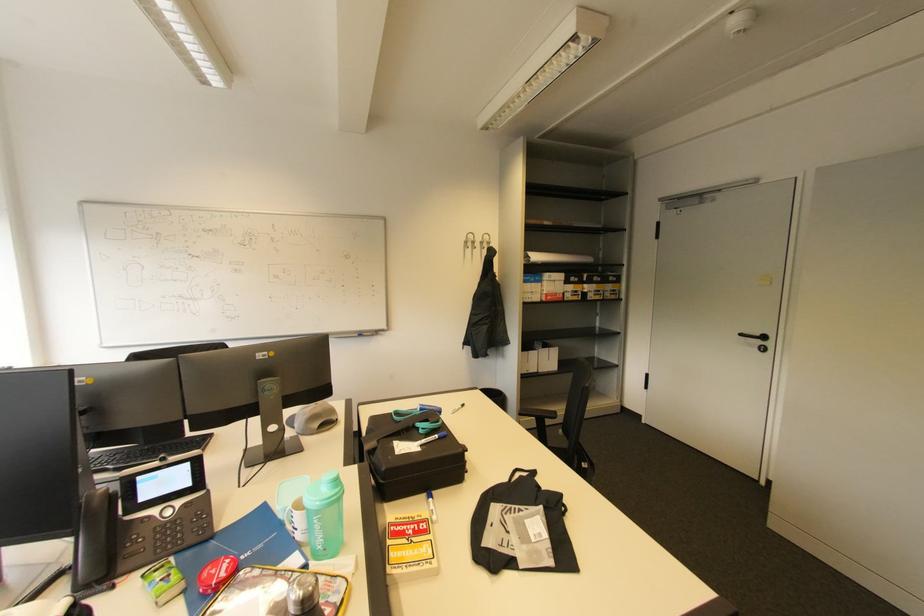
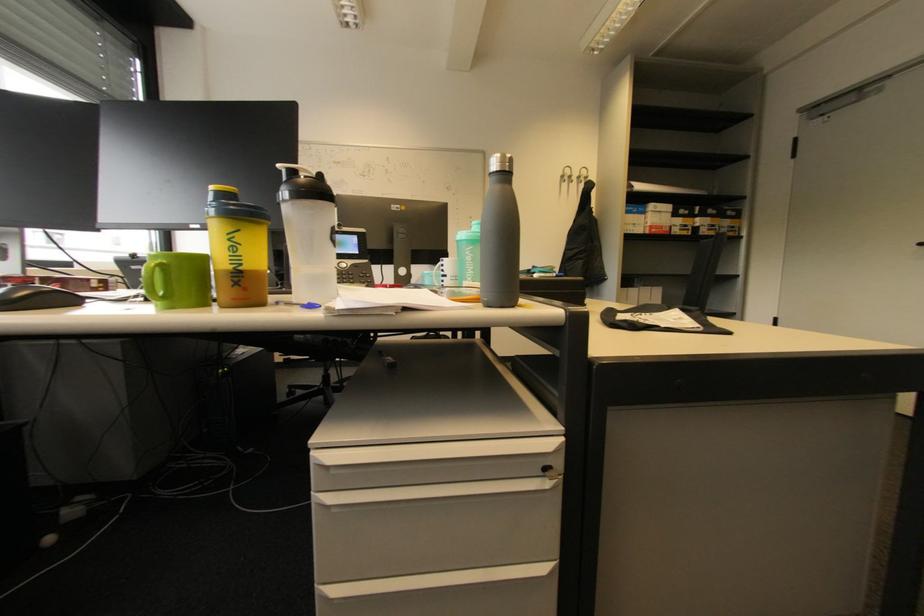
Looking at this image, the images are taken continuously from a first-person perspective. In which direction are you moving?

The cameraman walked toward left, backward.